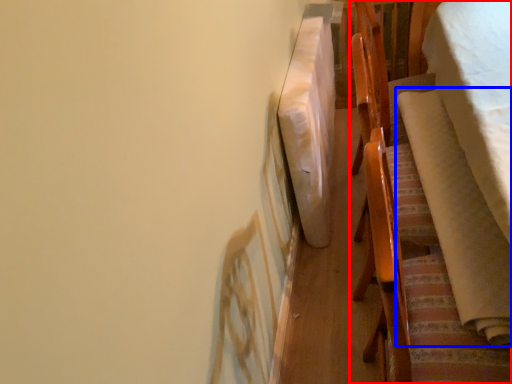
Question: Which object is further to the camera taking this photo, furniture (highlighted by a red box) or blanket (highlighted by a blue box)?

Choices:
 (A) furniture
 (B) blanket

Answer: (A)